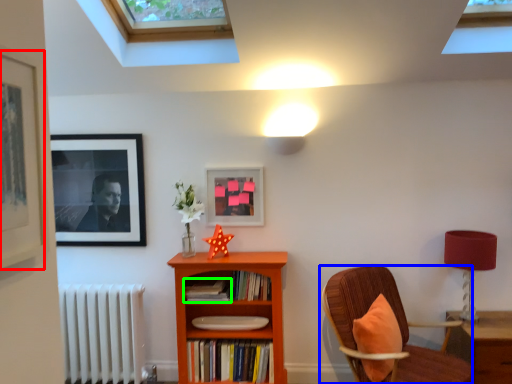
Question: Which is nearer to the picture frame (highlighted by a red box)? chair (highlighted by a blue box) or book (highlighted by a green box).

Choices:
 (A) chair
 (B) book

Answer: (B)